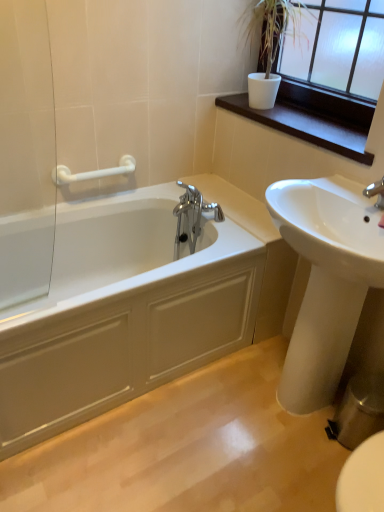
The height and width of the screenshot is (512, 384). I want to click on vacant area situated below white glossy sink at lower right (from a real-world perspective), so click(x=280, y=411).